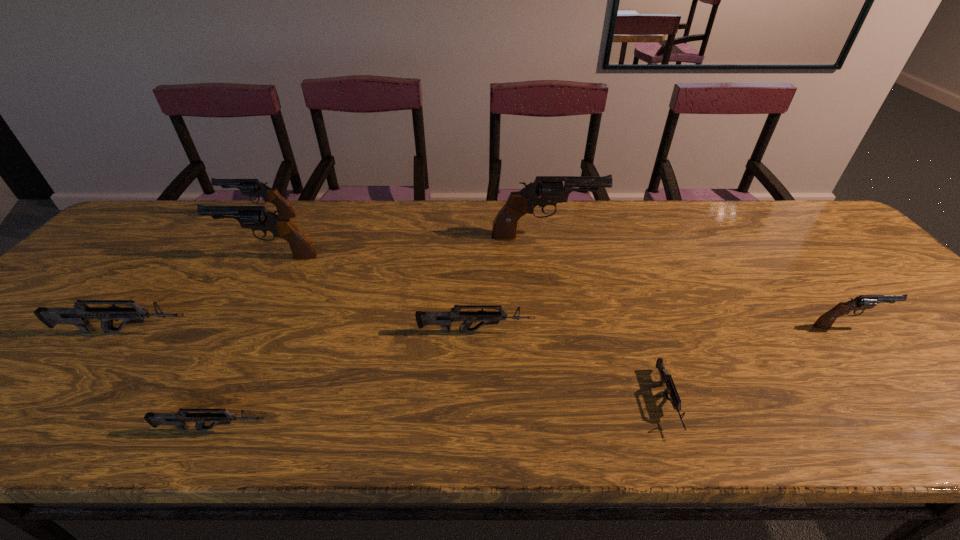
Where is `object that stands as the seventh closest to the nearest black gun`? This screenshot has width=960, height=540. object that stands as the seventh closest to the nearest black gun is located at coordinates (81, 314).

Point out which object is positioned as the third nearest to the seventh tallest gun. Please provide its 2D coordinates. Your answer should be formatted as a tuple, i.e. [(x, y)], where the tuple contains the x and y coordinates of a point satisfying the conditions above.

[(254, 217)]

Locate an element on the screen. This screenshot has height=540, width=960. gun that is the closest one to the third farthest black gun is located at coordinates (252, 187).

The width and height of the screenshot is (960, 540). I want to click on the sixth closest gun to the seventh object from left to right, so click(x=81, y=314).

This screenshot has height=540, width=960. Identify the location of black gun that is the third closest to the second biggest black gun. (862, 302).

The image size is (960, 540). I want to click on black gun identified as the third closest to the third biggest black gun, so click(862, 302).

You are a GUI agent. You are given a task and a screenshot of the screen. Output one action in this format:
    pyautogui.click(x=<x>, y=<y>)
    Task: Click on the closest grey gun to the biggest grey gun
    The height and width of the screenshot is (540, 960).
    Given the screenshot: What is the action you would take?
    pyautogui.click(x=179, y=419)

Find the location of a particular element. Image resolution: width=960 pixels, height=540 pixels. grey gun that stands as the second closest to the biggest grey gun is located at coordinates (442, 318).

The height and width of the screenshot is (540, 960). Identify the location of free location that satisfies the following two spatial constraints: 1. aimed along the barrel of the seventh gun from left to right; 2. aimed along the barrel of the seventh tallest object. (678, 429).